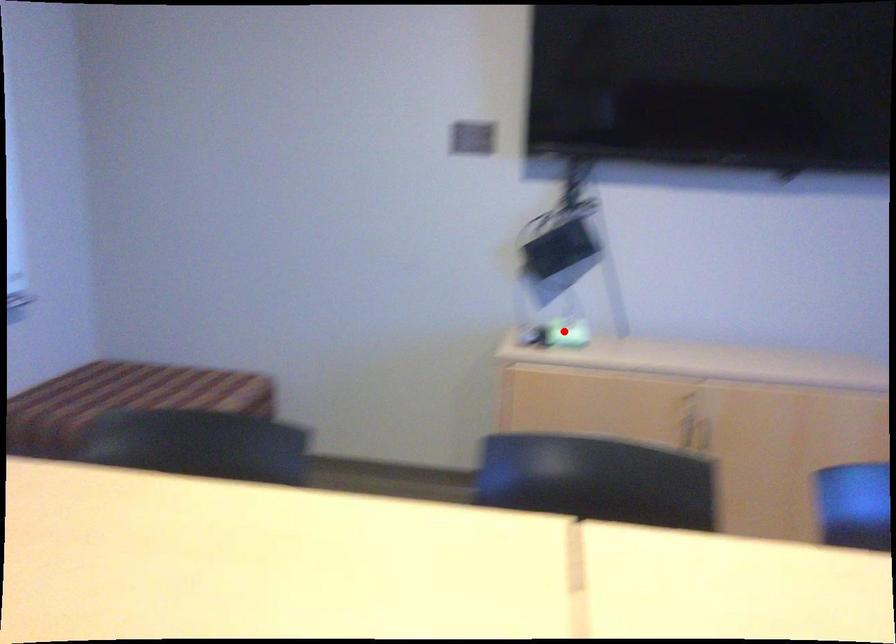
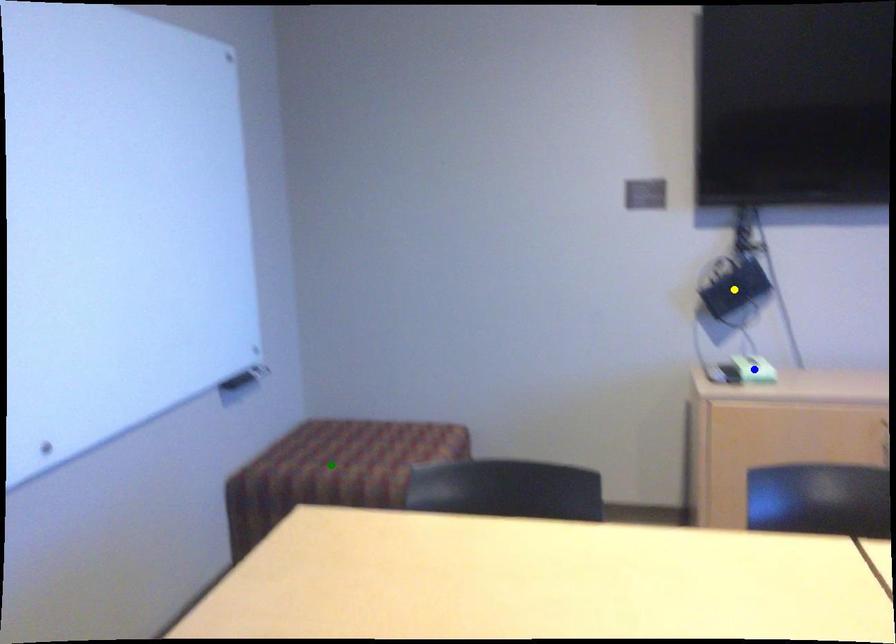
Question: I am providing you with two images of the same scene from different viewpoints. A red point is marked on the first image. You are given multiple points on the second image. Which point in image 2 is actually the same real-world point as the red point in image 1?

Choices:
 (A) blue point
 (B) yellow point
 (C) green point

Answer: (A)